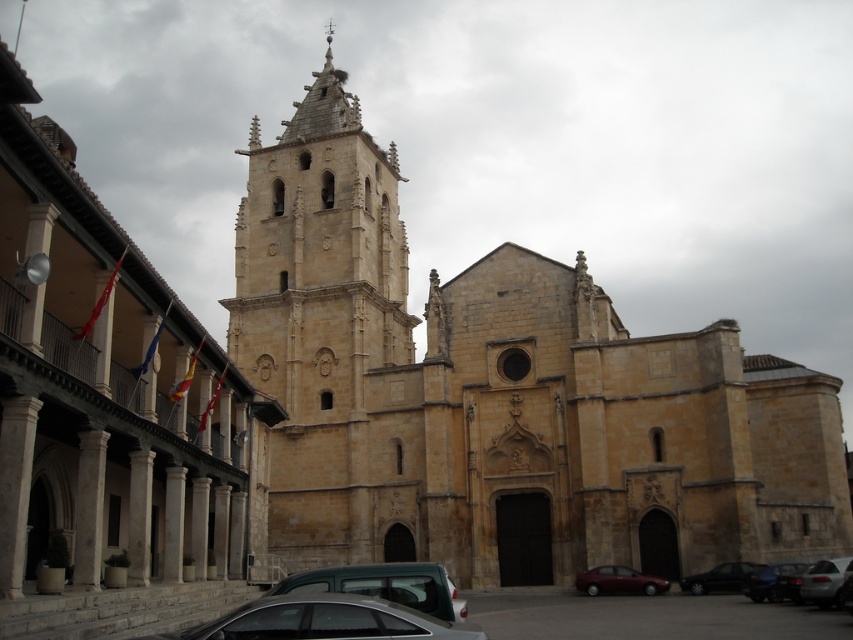
Question: Which object is the farthest from the beige stone church at center?

Choices:
 (A) dark gray metallic car at lower right
 (B) shiny red sedan at center
 (C) yellow stone tower at center

Answer: (A)

Question: Can you confirm if yellow stone tower at center is bigger than dark gray metallic car at lower right?

Choices:
 (A) no
 (B) yes

Answer: (B)

Question: Can you confirm if yellow stone tower at center is thinner than shiny black sedan at lower right?

Choices:
 (A) yes
 (B) no

Answer: (B)

Question: Which point is farther to the camera?

Choices:
 (A) (648, 582)
 (B) (459, 611)
 (C) (169, 528)

Answer: (A)

Question: Which object is closer to the camera taking this photo?

Choices:
 (A) yellow stone church at center
 (B) yellow stone tower at center

Answer: (A)

Question: Can you confirm if silver metallic car at lower right is positioned below shiny black sedan at lower right?

Choices:
 (A) yes
 (B) no

Answer: (B)